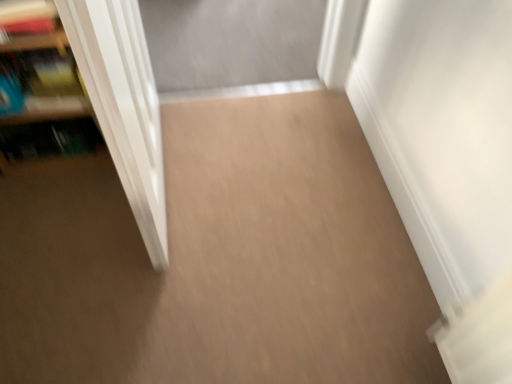
Locate an element on the screen. Image resolution: width=512 pixels, height=384 pixels. white glossy door at left is located at coordinates (123, 105).

What is the approximate width of white glossy door at left?

31.63 inches.

The image size is (512, 384). What do you see at coordinates (123, 105) in the screenshot? I see `white glossy door at left` at bounding box center [123, 105].

The width and height of the screenshot is (512, 384). What do you see at coordinates (42, 90) in the screenshot?
I see `wooden bookshelf at left` at bounding box center [42, 90].

At what (x,y) coordinates should I click in order to perform the action: click on wooden bookshelf at left. Please return your answer as a coordinate pair (x, y). Looking at the image, I should click on (42, 90).

You are a GUI agent. You are given a task and a screenshot of the screen. Output one action in this format:
    pyautogui.click(x=<x>, y=<y>)
    Task: Click on the white glossy door at left
    
    Given the screenshot: What is the action you would take?
    pyautogui.click(x=123, y=105)

Which object is positioned more to the right, wooden bookshelf at left or white glossy door at left?

Positioned to the right is white glossy door at left.

Which object is further away from the camera, wooden bookshelf at left or white glossy door at left?

wooden bookshelf at left is further from the camera.

Considering the positions of point (7, 149) and point (129, 164), is point (7, 149) closer or farther from the camera than point (129, 164)?

Point (7, 149) is farther from the camera than point (129, 164).

From the image's perspective, which is below, wooden bookshelf at left or white glossy door at left?

From the image's view, white glossy door at left is below.

From a real-world perspective, between wooden bookshelf at left and white glossy door at left, who is vertically higher?

white glossy door at left.

In the scene shown: Between wooden bookshelf at left and white glossy door at left, which one has smaller width?

With smaller width is wooden bookshelf at left.

Which of these two, wooden bookshelf at left or white glossy door at left, stands taller?

white glossy door at left is taller.

Between wooden bookshelf at left and white glossy door at left, which one has larger size?

white glossy door at left.

From the picture: Does wooden bookshelf at left contain white glossy door at left?

No, white glossy door at left is not inside wooden bookshelf at left.

Is wooden bookshelf at left not near white glossy door at left?

Actually, wooden bookshelf at left and white glossy door at left are a little close together.

Does wooden bookshelf at left turn towards white glossy door at left?

No, wooden bookshelf at left is not oriented towards white glossy door at left.

How many degrees apart are the facing directions of wooden bookshelf at left and white glossy door at left?

3.73 degrees separate the facing orientations of wooden bookshelf at left and white glossy door at left.

In order to click on shelf on the left of white glossy door at left in this screenshot , I will do `click(42, 90)`.

Considering the positions of objects white glossy door at left and wooden bookshelf at left in the image provided, who is more to the left, white glossy door at left or wooden bookshelf at left?

Positioned to the left is wooden bookshelf at left.

Which object is more forward, white glossy door at left or wooden bookshelf at left?

white glossy door at left.

Does point (131, 119) lie behind point (49, 95)?

No, (131, 119) is in front of (49, 95).

From the image's perspective, is white glossy door at left located beneath wooden bookshelf at left?

Yes, from the image's perspective, white glossy door at left is beneath wooden bookshelf at left.

From a real-world perspective, is white glossy door at left under wooden bookshelf at left?

Actually, white glossy door at left is physically above wooden bookshelf at left in the real world.

Does white glossy door at left have a lesser width compared to wooden bookshelf at left?

No.

Considering the relative sizes of white glossy door at left and wooden bookshelf at left in the image provided, is white glossy door at left taller than wooden bookshelf at left?

Correct, white glossy door at left is much taller as wooden bookshelf at left.

Between white glossy door at left and wooden bookshelf at left, which one has smaller size?

Smaller between the two is wooden bookshelf at left.

Consider the image. Is white glossy door at left spatially inside wooden bookshelf at left, or outside of it?

white glossy door at left is located beyond the bounds of wooden bookshelf at left.

In the scene shown: Are white glossy door at left and wooden bookshelf at left making contact?

No, white glossy door at left is not with wooden bookshelf at left.

Is wooden bookshelf at left at the back of white glossy door at left?

No, wooden bookshelf at left is not at the back of white glossy door at left.

Locate an element on the screen. Image resolution: width=512 pixels, height=384 pixels. door that appears above the wooden bookshelf at left (from a real-world perspective) is located at coordinates (123, 105).

Locate an element on the screen. The image size is (512, 384). door below the wooden bookshelf at left (from the image's perspective) is located at coordinates (123, 105).

Where is `door above the wooden bookshelf at left (from a real-world perspective)`? door above the wooden bookshelf at left (from a real-world perspective) is located at coordinates (123, 105).